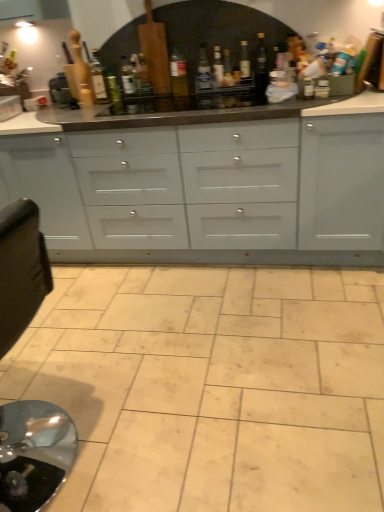
Identify the location of free space in front of translucent glass bottle at center, which is the 3th bottle in left-to-right order. The image size is (384, 512). (114, 105).